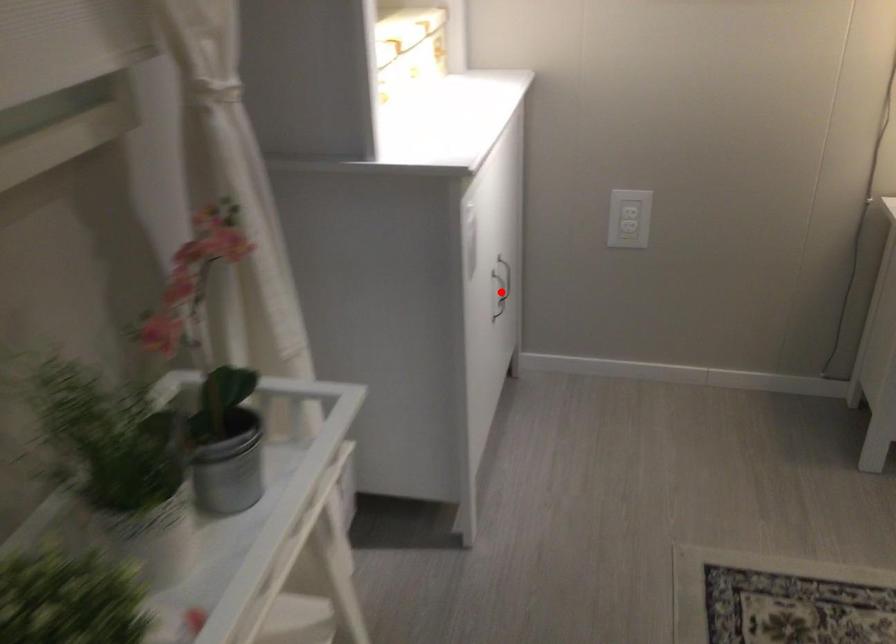
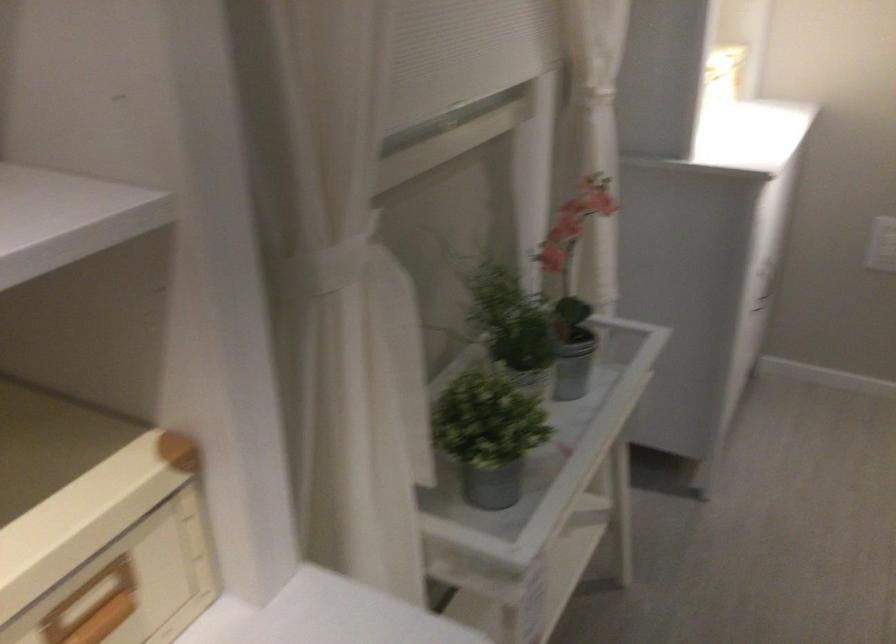
Question: I am providing you with two images of the same scene from different viewpoints. A red point is marked on the first image. Can you still see the location of the red point in image 2?

Choices:
 (A) Yes
 (B) No

Answer: (B)